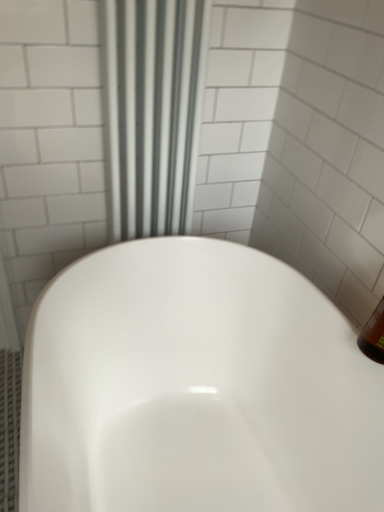
Question: Which is correct: white glossy bathtub at center is inside white fabric shower curtain at upper center, or outside of it?

Choices:
 (A) outside
 (B) inside

Answer: (A)

Question: Considering the positions of point (243, 490) and point (114, 142), is point (243, 490) closer or farther from the camera than point (114, 142)?

Choices:
 (A) closer
 (B) farther

Answer: (B)

Question: From the image's perspective, is white glossy bathtub at center positioned above or below white fabric shower curtain at upper center?

Choices:
 (A) below
 (B) above

Answer: (A)

Question: From a real-world perspective, is white fabric shower curtain at upper center above or below white glossy bathtub at center?

Choices:
 (A) below
 (B) above

Answer: (B)

Question: In terms of size, does white fabric shower curtain at upper center appear bigger or smaller than white glossy bathtub at center?

Choices:
 (A) small
 (B) big

Answer: (A)

Question: From the image's perspective, is white fabric shower curtain at upper center positioned above or below white glossy bathtub at center?

Choices:
 (A) above
 (B) below

Answer: (A)

Question: Does point (119, 27) appear closer or farther from the camera than point (190, 399)?

Choices:
 (A) closer
 (B) farther

Answer: (A)